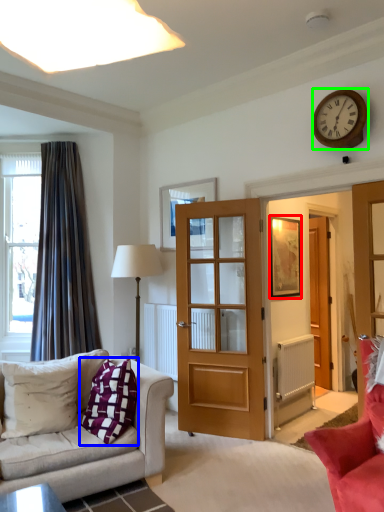
Question: Estimate the real-world distances between objects in this image. Which object is farther from picture frame (highlighted by a red box), pillow (highlighted by a blue box) or wall clock (highlighted by a green box)?

Choices:
 (A) pillow
 (B) wall clock

Answer: (A)